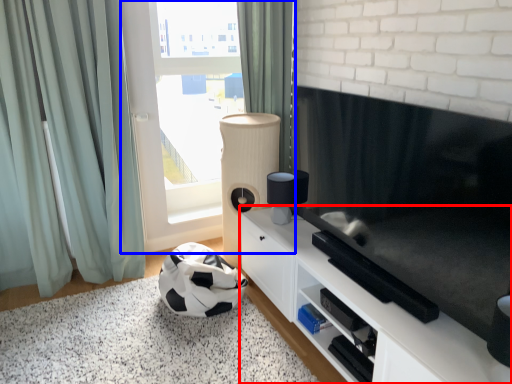
Question: Which object appears farthest to the camera in this image, cabinetry (highlighted by a red box) or window (highlighted by a blue box)?

Choices:
 (A) cabinetry
 (B) window

Answer: (B)